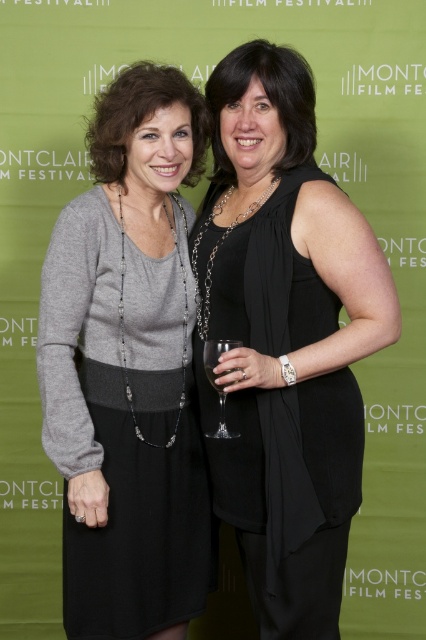
Question: Can you confirm if black satin dress at center is positioned above clear glass wine glass at center?

Choices:
 (A) no
 (B) yes

Answer: (B)

Question: Which point appears farthest from the camera in this image?

Choices:
 (A) (339, 484)
 (B) (215, 358)
 (C) (183, 460)
 (D) (229, 369)

Answer: (C)

Question: Estimate the real-world distances between objects in this image. Which object is farther from the clear glass at center?

Choices:
 (A) black satin dress at center
 (B) matte gray sweater at center

Answer: (B)

Question: Estimate the real-world distances between objects in this image. Which object is farther from the matte gray sweater at center?

Choices:
 (A) clear glass wine glass at center
 (B) black satin dress at center

Answer: (A)

Question: Is matte gray sweater at center to the right of clear glass wine glass at center from the viewer's perspective?

Choices:
 (A) no
 (B) yes

Answer: (A)

Question: Is black satin dress at center in front of clear glass at center?

Choices:
 (A) no
 (B) yes

Answer: (B)